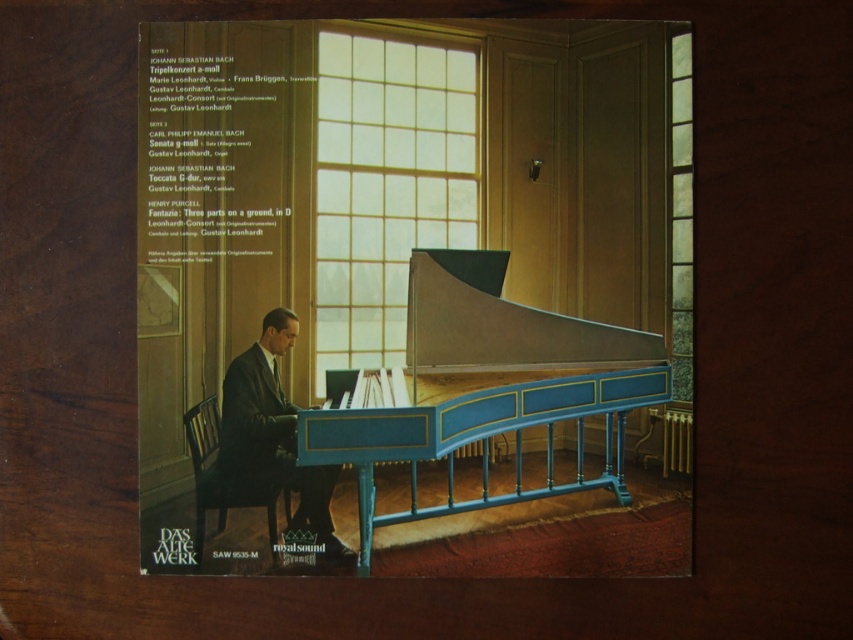
Is blue polished wood harpsichord at center to the right of dark suit at center from the viewer's perspective?

Yes, blue polished wood harpsichord at center is to the right of dark suit at center.

Between point (496, 376) and point (282, 394), which one is positioned in front?

Positioned in front is point (282, 394).

The width and height of the screenshot is (853, 640). Identify the location of blue polished wood harpsichord at center. (482, 388).

Where is `blue polished wood harpsichord at center`? This screenshot has height=640, width=853. blue polished wood harpsichord at center is located at coordinates (482, 388).